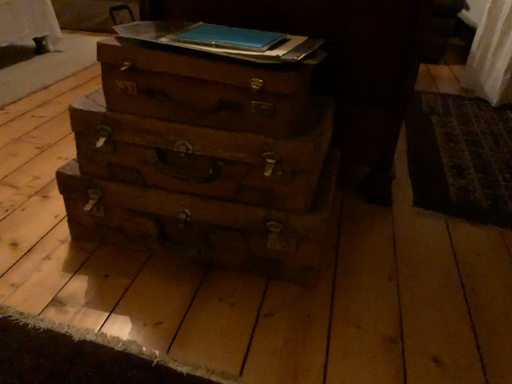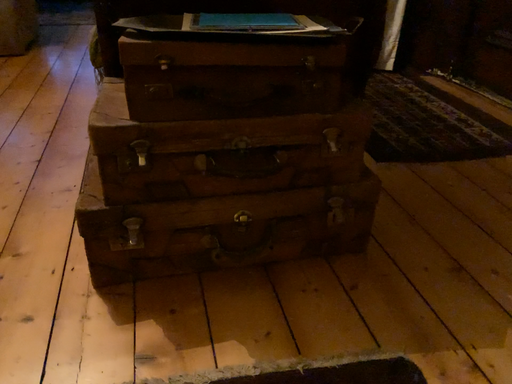
Question: Which way did the camera rotate in the video?

Choices:
 (A) rotated right
 (B) rotated left

Answer: (A)